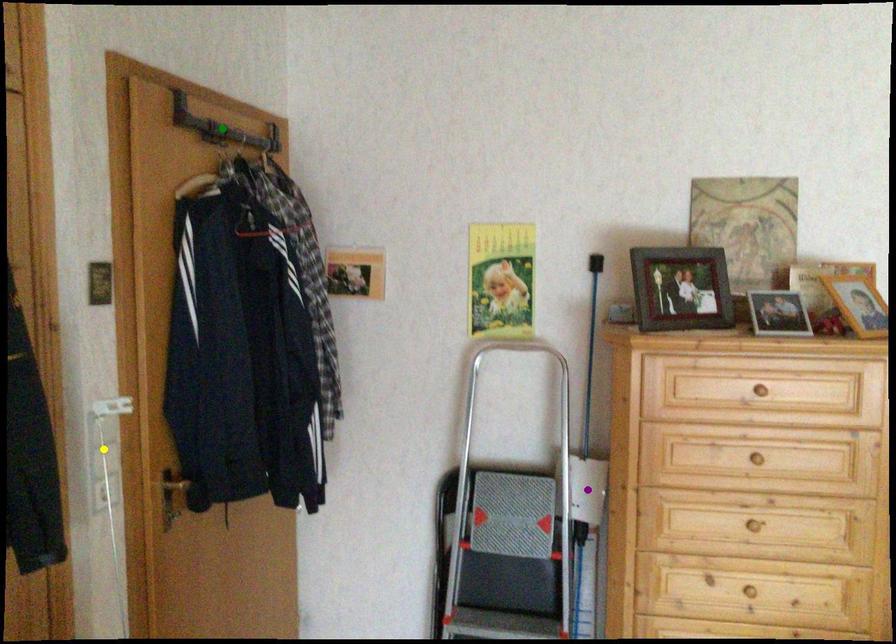
Order these from nearest to farthest:
green point
purple point
yellow point

purple point
green point
yellow point